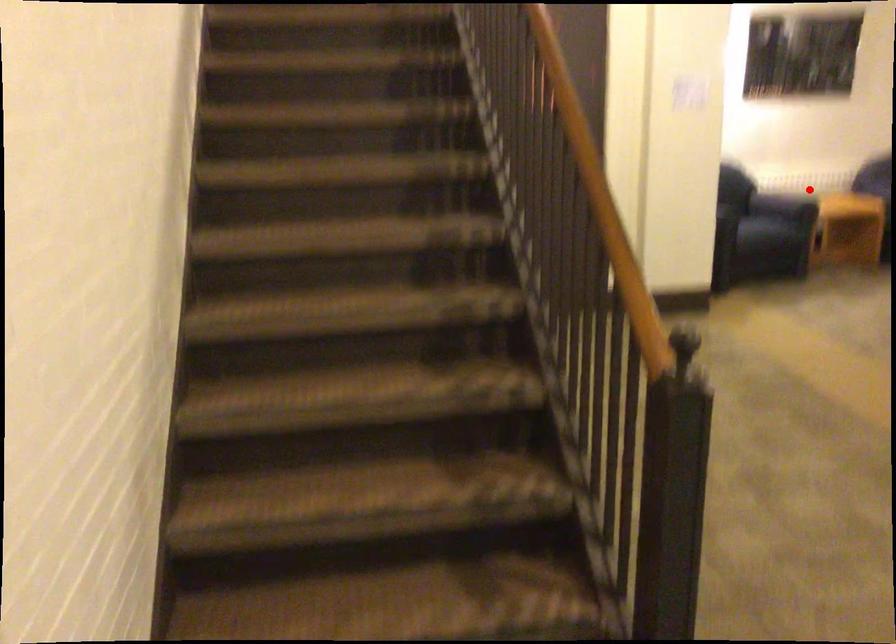
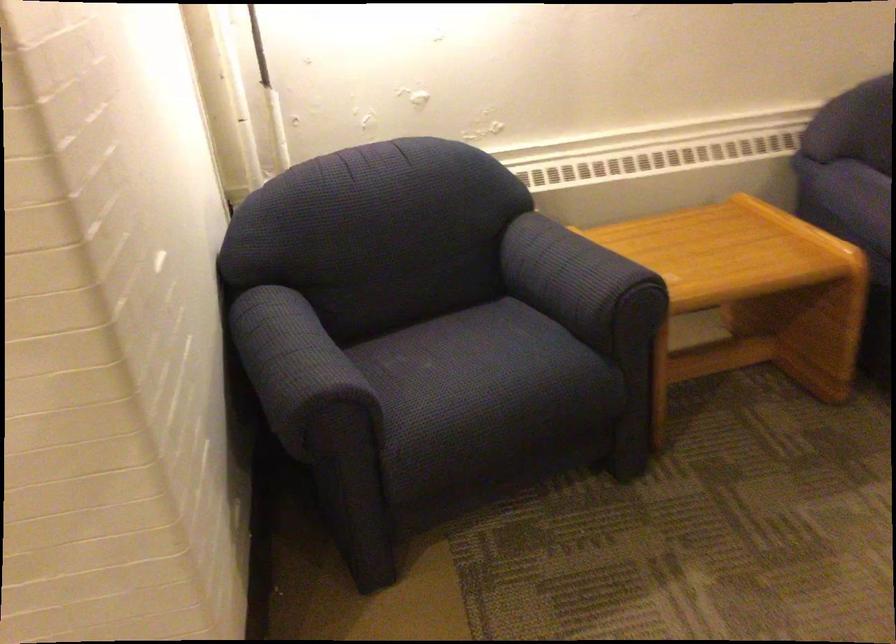
Question: I am providing you with two images of the same scene from different viewpoints. A red point is shown in image1. For the corresponding object point in image2, is it positioned nearer or farther from the camera?

Choices:
 (A) Nearer
 (B) Farther

Answer: (A)